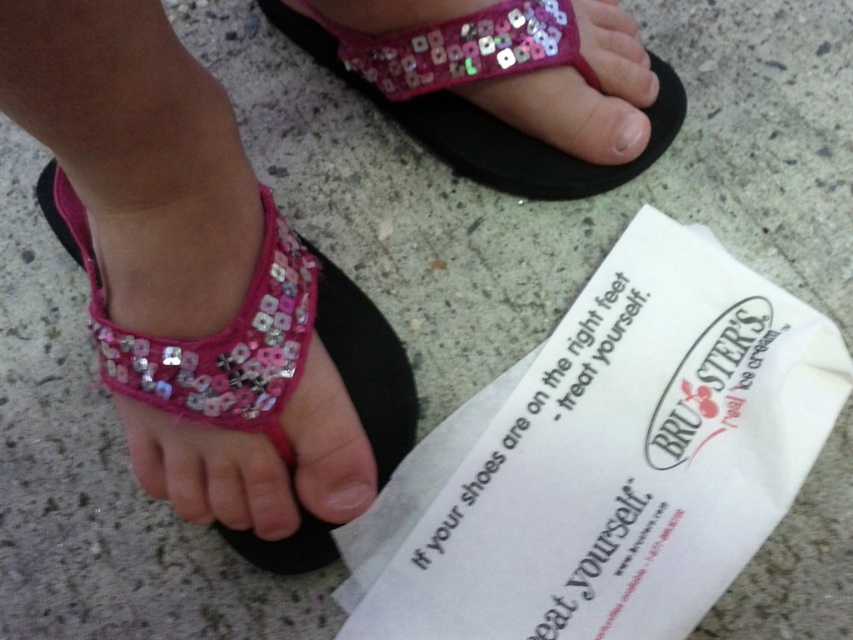
You are a child trying to walk while holding a heavy ice cream bag. Which part of your footwear will you focus on to maintain balance? The pink sequined sandal at upper center or the pink sequined toe at center?

The pink sequined sandal at upper center is bigger than the pink sequined toe at center, so focusing on the pink sequined sandal at upper center would provide better stability due to its larger surface area.

You are standing in front of a store and see the image. There is a point marked at coordinates (251, 445). What object is located at that point?

The point at coordinates 0.698, 0.298 indicates the pink sequined sandal at center.

You are a delivery robot that needs to place a small package between the pink sequined sandal at center and the pink sequined sandal at upper center. The package is 16 inches long. Can you fit the package between them without overlapping either sandal?

The distance between the pink sequined sandal at center and the pink sequined sandal at upper center is 15.78 inches. Since the package is 16 inches long, which is slightly longer than the available space, it cannot be placed between them without overlapping.